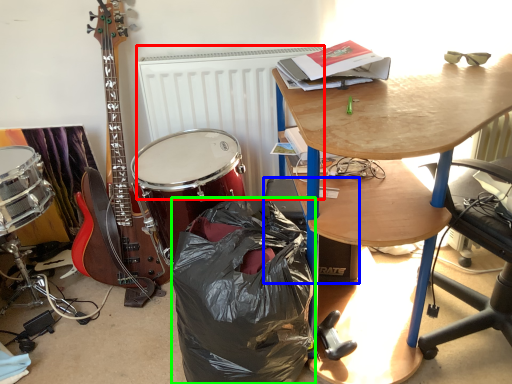
Question: Estimate the real-world distances between objects in this image. Which object is closer to radiator (highlighted by a red box), loudspeaker (highlighted by a blue box) or trash bin/can (highlighted by a green box)?

Choices:
 (A) loudspeaker
 (B) trash bin/can

Answer: (A)